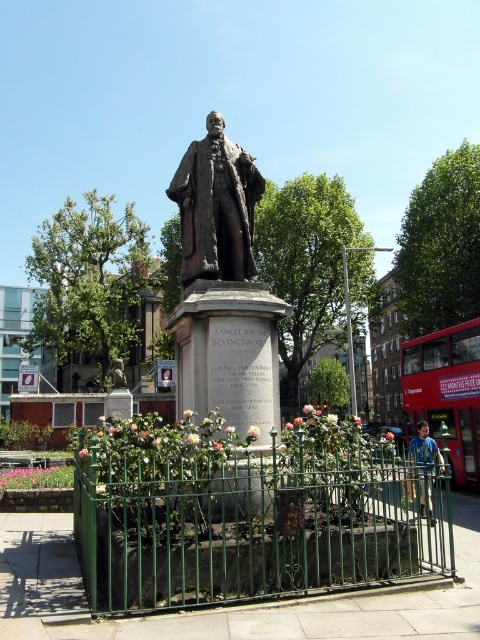
Who is lower down, red rubber double-decker bus at right or blue cotton shirt at lower right?

Positioned lower is blue cotton shirt at lower right.

Which of these two, red rubber double-decker bus at right or blue cotton shirt at lower right, stands shorter?

blue cotton shirt at lower right

Between point (439, 385) and point (428, 442), which one is positioned in front?

Point (428, 442) is more forward.

Where is `red rubber double-decker bus at right`? This screenshot has height=640, width=480. red rubber double-decker bus at right is located at coordinates (445, 394).

Can you confirm if green wrought iron fence at lower center is positioned below bronze statue at center?

Correct, green wrought iron fence at lower center is located below bronze statue at center.

Does green wrought iron fence at lower center appear on the left side of bronze statue at center?

In fact, green wrought iron fence at lower center is to the right of bronze statue at center.

Does point (132, 540) lie in front of point (247, 180)?

Yes, point (132, 540) is in front of point (247, 180).

I want to click on green wrought iron fence at lower center, so click(251, 524).

Is bronze statue at center smaller than red rubber double-decker bus at right?

Indeed, bronze statue at center has a smaller size compared to red rubber double-decker bus at right.

The height and width of the screenshot is (640, 480). What do you see at coordinates (216, 205) in the screenshot?
I see `bronze statue at center` at bounding box center [216, 205].

You are a GUI agent. You are given a task and a screenshot of the screen. Output one action in this format:
    pyautogui.click(x=<x>, y=<y>)
    Task: Click on the bronze statue at center
    
    Given the screenshot: What is the action you would take?
    pyautogui.click(x=216, y=205)